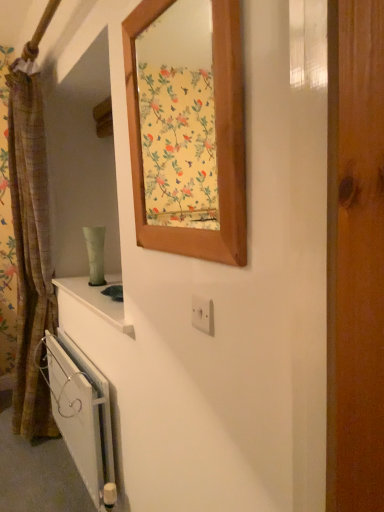
What do you see at coordinates (178, 117) in the screenshot? The width and height of the screenshot is (384, 512). I see `wooden frame at upper center` at bounding box center [178, 117].

In order to face white metallic radiator at lower left, should I rotate leftwards or rightwards?

Turn left approximately 15.337 degrees to face it.

The image size is (384, 512). I want to click on brown textured curtain at left, so click(x=30, y=253).

Is white metallic radiator at lower left to the right of wooden frame at upper center from the viewer's perspective?

No, white metallic radiator at lower left is not to the right of wooden frame at upper center.

From the image's perspective, between white metallic radiator at lower left and wooden frame at upper center, who is located below?

From the image's view, white metallic radiator at lower left is below.

Can you tell me how much white metallic radiator at lower left and wooden frame at upper center differ in facing direction?

They differ by 0.698 degrees in their facing directions.

Does white metallic radiator at lower left have a lesser width compared to wooden frame at upper center?

Incorrect, the width of white metallic radiator at lower left is not less than that of wooden frame at upper center.

Is white metallic radiator at lower left positioned beyond the bounds of brown textured curtain at left?

That's incorrect, white metallic radiator at lower left is not completely outside brown textured curtain at left.

From the image's perspective, which is above, white metallic radiator at lower left or brown textured curtain at left?

From the image's view, brown textured curtain at left is above.

Considering the relative positions of white metallic radiator at lower left and brown textured curtain at left in the image provided, is white metallic radiator at lower left behind brown textured curtain at left?

No, white metallic radiator at lower left is closer to the camera.

Between white plastic electric outlet at center and wooden frame at upper center, which one appears on the left side from the viewer's perspective?

Positioned to the left is wooden frame at upper center.

From the image's perspective, is white plastic electric outlet at center located beneath wooden frame at upper center?

Yes, from the image's perspective, white plastic electric outlet at center is beneath wooden frame at upper center.

Identify the location of electric outlet below the wooden frame at upper center (from a real-world perspective). Image resolution: width=384 pixels, height=512 pixels. (203, 314).

Could you tell me if white plastic electric outlet at center is facing wooden frame at upper center?

No, white plastic electric outlet at center is not oriented towards wooden frame at upper center.

This screenshot has width=384, height=512. In order to click on electric outlet behind the wooden frame at upper center in this screenshot , I will do `click(203, 314)`.

From a real-world perspective, who is located higher, wooden frame at upper center or white plastic electric outlet at center?

wooden frame at upper center is physically above.

From the picture: Would you consider wooden frame at upper center to be distant from white plastic electric outlet at center?

Yes, wooden frame at upper center and white plastic electric outlet at center are quite far apart.

Can you confirm if wooden frame at upper center is wider than white plastic electric outlet at center?

Yes, wooden frame at upper center is wider than white plastic electric outlet at center.

Considering the points (32, 402) and (71, 448), which point is in front, point (32, 402) or point (71, 448)?

The point (71, 448) is in front.

Considering the sizes of objects brown textured curtain at left and white metallic radiator at lower left in the image provided, who is taller, brown textured curtain at left or white metallic radiator at lower left?

brown textured curtain at left is taller.

Could you tell me if brown textured curtain at left is facing white metallic radiator at lower left?

No, brown textured curtain at left is not turned towards white metallic radiator at lower left.

Which of these two, brown textured curtain at left or white metallic radiator at lower left, is smaller?

Smaller between the two is white metallic radiator at lower left.

Are white metallic radiator at lower left and white plastic electric outlet at center far apart?

Yes, white metallic radiator at lower left is far from white plastic electric outlet at center.

Which object is thinner, white metallic radiator at lower left or white plastic electric outlet at center?

white plastic electric outlet at center is thinner.

Is white metallic radiator at lower left located outside white plastic electric outlet at center?

white metallic radiator at lower left is positioned outside white plastic electric outlet at center.

Which is closer, (x=91, y=456) or (x=197, y=320)?

Point (x=91, y=456) appears to be farther away from the viewer than point (x=197, y=320).

Does white plastic electric outlet at center appear on the right side of white metallic radiator at lower left?

Indeed, white plastic electric outlet at center is positioned on the right side of white metallic radiator at lower left.

Is white plastic electric outlet at center surrounding white metallic radiator at lower left?

That's incorrect, white metallic radiator at lower left is not inside white plastic electric outlet at center.

From the image's perspective, is white plastic electric outlet at center above or below white metallic radiator at lower left?

From the image's perspective, white plastic electric outlet at center appears above white metallic radiator at lower left.

Where is `mirror located above the white metallic radiator at lower left (from the image's perspective)`? The height and width of the screenshot is (512, 384). mirror located above the white metallic radiator at lower left (from the image's perspective) is located at coordinates (178, 117).

At what (x,y) coordinates should I click in order to perform the action: click on curtain on the left of white metallic radiator at lower left. Please return your answer as a coordinate pair (x, y). This screenshot has height=512, width=384. Looking at the image, I should click on tap(30, 253).

Looking at the image, which one is located further to wooden frame at upper center, white metallic radiator at lower left or brown textured curtain at left?

white metallic radiator at lower left.

Estimate the real-world distances between objects in this image. Which object is closer to wooden frame at upper center, white metallic radiator at lower left or white plastic electric outlet at center?

white metallic radiator at lower left lies closer to wooden frame at upper center than the other object.

When comparing their distances from brown textured curtain at left, does white plastic electric outlet at center or white metallic radiator at lower left seem further?

white plastic electric outlet at center.

When comparing their distances from white plastic electric outlet at center, does wooden frame at upper center or white metallic radiator at lower left seem closer?

white metallic radiator at lower left lies closer to white plastic electric outlet at center than the other object.

When comparing their distances from wooden frame at upper center, does brown textured curtain at left or white metallic radiator at lower left seem closer?

brown textured curtain at left lies closer to wooden frame at upper center than the other object.

Considering their positions, is brown textured curtain at left positioned closer to white metallic radiator at lower left than wooden frame at upper center?

brown textured curtain at left.

Which object lies further to the anchor point white metallic radiator at lower left, white plastic electric outlet at center or wooden frame at upper center?

wooden frame at upper center.

Which object lies nearer to the anchor point white plastic electric outlet at center, brown textured curtain at left or white metallic radiator at lower left?

white metallic radiator at lower left lies closer to white plastic electric outlet at center than the other object.

You are a GUI agent. You are given a task and a screenshot of the screen. Output one action in this format:
    pyautogui.click(x=<x>, y=<y>)
    Task: Click on the electric outlet between wooden frame at upper center and white metallic radiator at lower left from top to bottom
    This screenshot has height=512, width=384.
    Given the screenshot: What is the action you would take?
    pyautogui.click(x=203, y=314)

Image resolution: width=384 pixels, height=512 pixels. Identify the location of radiator positioned between wooden frame at upper center and brown textured curtain at left from near to far. (82, 415).

You are a GUI agent. You are given a task and a screenshot of the screen. Output one action in this format:
    pyautogui.click(x=<x>, y=<y>)
    Task: Click on the electric outlet between wooden frame at upper center and brown textured curtain at left from front to back
    Image resolution: width=384 pixels, height=512 pixels.
    Given the screenshot: What is the action you would take?
    pyautogui.click(x=203, y=314)

Where is `radiator between brown textured curtain at left and white plastic electric outlet at center`? This screenshot has width=384, height=512. radiator between brown textured curtain at left and white plastic electric outlet at center is located at coordinates (82, 415).